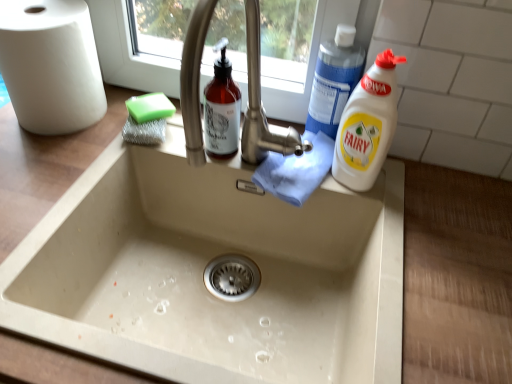
What is the approximate width of blue plastic bottle at upper right, the 1th cleaning product from the top?

3.18 inches.

At what (x,y) coordinates should I click in order to perform the action: click on white plastic bottle at right, the 2th cleaning product positioned from the top. Please return your answer as a coordinate pair (x, y). The image size is (512, 384). Looking at the image, I should click on (367, 125).

Image resolution: width=512 pixels, height=384 pixels. I want to click on green sponge at upper left, so click(150, 107).

Find the location of a particular element. blue plastic bottle at upper right, which is counted as the second cleaning product, starting from the bottom is located at coordinates (334, 80).

Can white matte paper towel at left be found inside blue plastic bottle at upper right, which is counted as the second cleaning product, starting from the bottom?

No, blue plastic bottle at upper right, which is counted as the second cleaning product, starting from the bottom, does not contain white matte paper towel at left.

Is point (317, 81) closer or farther from the camera than point (101, 90)?

Point (317, 81).

Can you tell me how much blue plastic bottle at upper right, which is counted as the second cleaning product, starting from the bottom, and white matte paper towel at left differ in facing direction?

0.253 degrees.

Is blue plastic bottle at upper right, the 1th cleaning product from the top, aimed at white matte paper towel at left?

No, blue plastic bottle at upper right, the 1th cleaning product from the top, is not aimed at white matte paper towel at left.

From the image's perspective, is green sponge at upper left beneath white matte paper towel at left?

Yes, from the image's perspective, green sponge at upper left is beneath white matte paper towel at left.

Who is shorter, green sponge at upper left or white matte paper towel at left?

Standing shorter between the two is green sponge at upper left.

From a real-world perspective, relative to white matte paper towel at left, is green sponge at upper left vertically above or below?

green sponge at upper left is situated lower than white matte paper towel at left in the real world.

Is green sponge at upper left oriented towards white matte paper towel at left?

No, green sponge at upper left is not aimed at white matte paper towel at left.

Relative to white plastic bottle at right, the 1th cleaning product when ordered from bottom to top, is green sponge at upper left in front or behind?

Clearly, green sponge at upper left is behind white plastic bottle at right, the 1th cleaning product when ordered from bottom to top.

Is green sponge at upper left touching white plastic bottle at right, the 2th cleaning product positioned from the top?

No, green sponge at upper left is not beside white plastic bottle at right, the 2th cleaning product positioned from the top.

Could you tell me if green sponge at upper left is facing white plastic bottle at right, the 2th cleaning product positioned from the top?

No, green sponge at upper left does not turn towards white plastic bottle at right, the 2th cleaning product positioned from the top.

Is white plastic bottle at right, the 1th cleaning product when ordered from bottom to top, not within white matte paper towel at left?

Indeed, white plastic bottle at right, the 1th cleaning product when ordered from bottom to top, is completely outside white matte paper towel at left.

Which object is closer to the camera taking this photo, white plastic bottle at right, the 1th cleaning product when ordered from bottom to top, or white matte paper towel at left?

white plastic bottle at right, the 1th cleaning product when ordered from bottom to top, is more forward.

Who is shorter, white plastic bottle at right, the 1th cleaning product when ordered from bottom to top, or white matte paper towel at left?

white matte paper towel at left.

Is white plastic bottle at right, the 2th cleaning product positioned from the top, looking in the opposite direction of white matte paper towel at left?

→ That's not correct — white plastic bottle at right, the 2th cleaning product positioned from the top, is not looking away from white matte paper towel at left.

Is white plastic bottle at right, the 1th cleaning product when ordered from bottom to top, bigger than blue plastic bottle at upper right, which is counted as the second cleaning product, starting from the bottom?

Yes, white plastic bottle at right, the 1th cleaning product when ordered from bottom to top, is bigger than blue plastic bottle at upper right, which is counted as the second cleaning product, starting from the bottom.

In the scene shown: Can you confirm if white plastic bottle at right, the 1th cleaning product when ordered from bottom to top, is taller than blue plastic bottle at upper right, which is counted as the second cleaning product, starting from the bottom?

Indeed, white plastic bottle at right, the 1th cleaning product when ordered from bottom to top, has a greater height compared to blue plastic bottle at upper right, which is counted as the second cleaning product, starting from the bottom.

From a real-world perspective, which is physically above, white plastic bottle at right, the 2th cleaning product positioned from the top, or blue plastic bottle at upper right, the 1th cleaning product from the top?

blue plastic bottle at upper right, the 1th cleaning product from the top.

This screenshot has width=512, height=384. What are the coordinates of `soap directly beneath the blue plastic bottle at upper right, the 1th cleaning product from the top (from a real-world perspective)` in the screenshot? It's located at (150, 107).

Does green sponge at upper left turn towards blue plastic bottle at upper right, which is counted as the second cleaning product, starting from the bottom?

No, green sponge at upper left is not oriented towards blue plastic bottle at upper right, which is counted as the second cleaning product, starting from the bottom.

Are green sponge at upper left and blue plastic bottle at upper right, the 1th cleaning product from the top, located far from each other?

No, green sponge at upper left is not far from blue plastic bottle at upper right, the 1th cleaning product from the top.

From the image's perspective, which object appears higher, green sponge at upper left or blue plastic bottle at upper right, which is counted as the second cleaning product, starting from the bottom?

blue plastic bottle at upper right, which is counted as the second cleaning product, starting from the bottom, is shown above in the image.

Consider the image. Is white matte paper towel at left positioned behind white plastic bottle at right, the 1th cleaning product when ordered from bottom to top?

Yes, white matte paper towel at left is further from the viewer.

From the image's perspective, which one is positioned higher, white matte paper towel at left or white plastic bottle at right, the 2th cleaning product positioned from the top?

white matte paper towel at left.

Would you consider white matte paper towel at left to be distant from white plastic bottle at right, the 2th cleaning product positioned from the top?

Actually, white matte paper towel at left and white plastic bottle at right, the 2th cleaning product positioned from the top, are a little close together.

Is point (59, 54) farther from viewer compared to point (368, 147)?

Yes, it is behind point (368, 147).

At what (x,y) coordinates should I click in order to perform the action: click on paper towel located on the left of blue plastic bottle at upper right, the 1th cleaning product from the top. Please return your answer as a coordinate pair (x, y). Looking at the image, I should click on (51, 65).

The width and height of the screenshot is (512, 384). Identify the location of soap behind the white matte paper towel at left. (150, 107).

Consider the image. When comparing their distances from blue plastic bottle at upper right, the 1th cleaning product from the top, does white plastic bottle at right, the 1th cleaning product when ordered from bottom to top, or white matte paper towel at left seem further?

white matte paper towel at left.

From the image, which object appears to be nearer to white plastic bottle at right, the 1th cleaning product when ordered from bottom to top, blue plastic bottle at upper right, which is counted as the second cleaning product, starting from the bottom, or green sponge at upper left?

Based on the image, blue plastic bottle at upper right, which is counted as the second cleaning product, starting from the bottom, appears to be nearer to white plastic bottle at right, the 1th cleaning product when ordered from bottom to top.

Considering their positions, is white matte paper towel at left positioned closer to green sponge at upper left than blue plastic bottle at upper right, which is counted as the second cleaning product, starting from the bottom?

white matte paper towel at left.

Which object lies nearer to the anchor point blue plastic bottle at upper right, the 1th cleaning product from the top, white plastic bottle at right, the 1th cleaning product when ordered from bottom to top, or green sponge at upper left?

white plastic bottle at right, the 1th cleaning product when ordered from bottom to top, lies closer to blue plastic bottle at upper right, the 1th cleaning product from the top, than the other object.

Estimate the real-world distances between objects in this image. Which object is further from white plastic bottle at right, the 2th cleaning product positioned from the top, green sponge at upper left or white matte paper towel at left?

white matte paper towel at left.

Looking at this image, considering their positions, is green sponge at upper left positioned further to white plastic bottle at right, the 1th cleaning product when ordered from bottom to top, than blue plastic bottle at upper right, the 1th cleaning product from the top?

The object further to white plastic bottle at right, the 1th cleaning product when ordered from bottom to top, is green sponge at upper left.

Based on their spatial positions, is white matte paper towel at left or blue plastic bottle at upper right, which is counted as the second cleaning product, starting from the bottom, further from white plastic bottle at right, the 1th cleaning product when ordered from bottom to top?

Based on the image, white matte paper towel at left appears to be further to white plastic bottle at right, the 1th cleaning product when ordered from bottom to top.

Based on their spatial positions, is white matte paper towel at left or white plastic bottle at right, the 1th cleaning product when ordered from bottom to top, further from blue plastic bottle at upper right, which is counted as the second cleaning product, starting from the bottom?

The object further to blue plastic bottle at upper right, which is counted as the second cleaning product, starting from the bottom, is white matte paper towel at left.

Locate an element on the screen. This screenshot has height=384, width=512. cleaning product between white matte paper towel at left and white plastic bottle at right, the 2th cleaning product positioned from the top, from left to right is located at coordinates (334, 80).

Locate an element on the screen. This screenshot has height=384, width=512. soap between white matte paper towel at left and blue plastic bottle at upper right, which is counted as the second cleaning product, starting from the bottom, from left to right is located at coordinates (150, 107).

Locate an element on the screen. cleaning product between green sponge at upper left and white plastic bottle at right, the 1th cleaning product when ordered from bottom to top, from left to right is located at coordinates (334, 80).

Locate an element on the screen. The height and width of the screenshot is (384, 512). soap between white matte paper towel at left and white plastic bottle at right, the 2th cleaning product positioned from the top, from left to right is located at coordinates (150, 107).